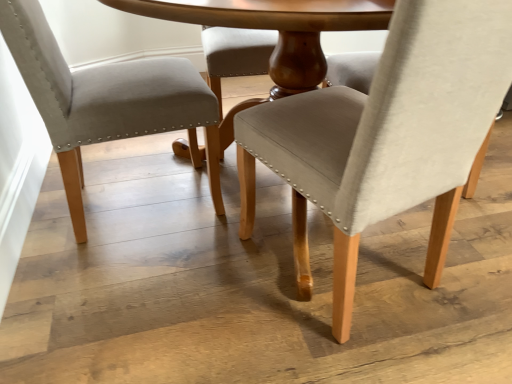
Question: Does beige fabric chair at left, which is the 2th chair from right to left, have a greater height compared to matte beige fabric chair at center, marked as the 1th chair in a right-to-left arrangement?

Choices:
 (A) yes
 (B) no

Answer: (B)

Question: Is matte beige fabric chair at center, which is counted as the 2th chair, starting from the left, inside beige fabric chair at left, which is the 2th chair from right to left?

Choices:
 (A) no
 (B) yes

Answer: (A)

Question: From the image's perspective, is beige fabric chair at left, which is the 2th chair from right to left, located above matte beige fabric chair at center, which is counted as the 2th chair, starting from the left?

Choices:
 (A) no
 (B) yes

Answer: (B)

Question: Is beige fabric chair at left, the first chair positioned from the left, smaller than matte beige fabric chair at center, which is counted as the 2th chair, starting from the left?

Choices:
 (A) yes
 (B) no

Answer: (A)

Question: Considering the relative sizes of beige fabric chair at left, which is the 2th chair from right to left, and matte beige fabric chair at center, which is counted as the 2th chair, starting from the left, in the image provided, is beige fabric chair at left, which is the 2th chair from right to left, shorter than matte beige fabric chair at center, which is counted as the 2th chair, starting from the left,?

Choices:
 (A) no
 (B) yes

Answer: (B)

Question: Is beige fabric chair at left, the first chair positioned from the left, positioned with its back to matte beige fabric chair at center, marked as the 1th chair in a right-to-left arrangement?

Choices:
 (A) yes
 (B) no

Answer: (B)

Question: Is the position of matte beige fabric chair at center, marked as the 1th chair in a right-to-left arrangement, more distant than that of beige fabric chair at left, the first chair positioned from the left?

Choices:
 (A) yes
 (B) no

Answer: (B)

Question: Is matte beige fabric chair at center, which is counted as the 2th chair, starting from the left, facing towards beige fabric chair at left, which is the 2th chair from right to left?

Choices:
 (A) yes
 (B) no

Answer: (B)

Question: Is matte beige fabric chair at center, which is counted as the 2th chair, starting from the left, wider than beige fabric chair at left, which is the 2th chair from right to left?

Choices:
 (A) no
 (B) yes

Answer: (A)

Question: Can you see matte beige fabric chair at center, marked as the 1th chair in a right-to-left arrangement, touching beige fabric chair at left, the first chair positioned from the left?

Choices:
 (A) yes
 (B) no

Answer: (B)

Question: From a real-world perspective, is matte beige fabric chair at center, which is counted as the 2th chair, starting from the left, on beige fabric chair at left, the first chair positioned from the left?

Choices:
 (A) no
 (B) yes

Answer: (B)

Question: Is matte beige fabric chair at center, marked as the 1th chair in a right-to-left arrangement, positioned with its back to beige fabric chair at left, the first chair positioned from the left?

Choices:
 (A) yes
 (B) no

Answer: (B)

Question: From a real-world perspective, is matte beige fabric chair at center, which is counted as the 2th chair, starting from the left, positioned above or below beige fabric chair at left, which is the 2th chair from right to left?

Choices:
 (A) above
 (B) below

Answer: (A)